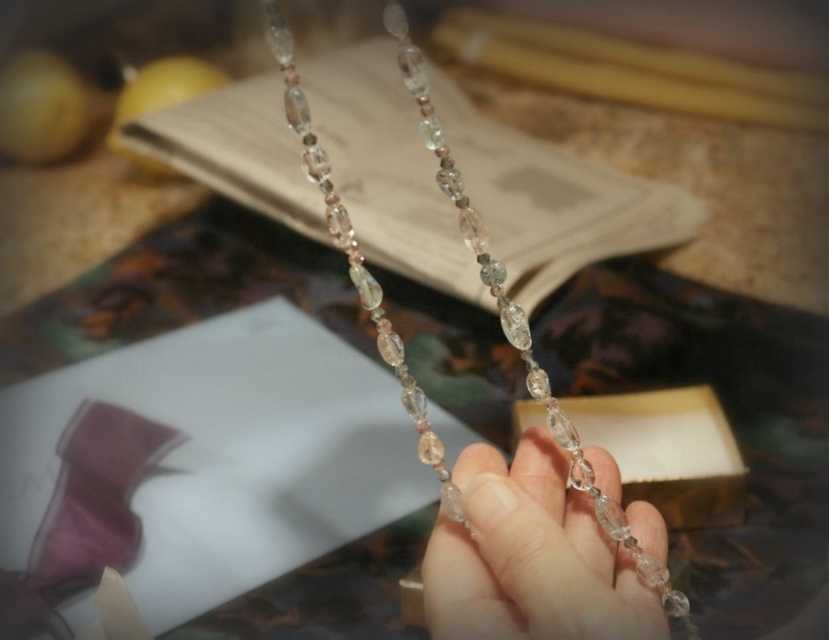
Question: Which object appears closest to the camera in this image?

Choices:
 (A) clear crystal beads at center
 (B) clear crystal necklace at center

Answer: (A)

Question: From the image, what is the correct spatial relationship of clear crystal beads at center in relation to clear crystal necklace at center?

Choices:
 (A) left
 (B) right

Answer: (B)

Question: Can you confirm if clear crystal beads at center is bigger than clear crystal necklace at center?

Choices:
 (A) no
 (B) yes

Answer: (A)

Question: Among these objects, which one is nearest to the camera?

Choices:
 (A) clear crystal beads at center
 (B) clear crystal necklace at center

Answer: (A)

Question: Is clear crystal beads at center above clear crystal necklace at center?

Choices:
 (A) no
 (B) yes

Answer: (A)

Question: Among these points, which one is nearest to the camera?

Choices:
 (A) (362, 273)
 (B) (587, 605)

Answer: (B)